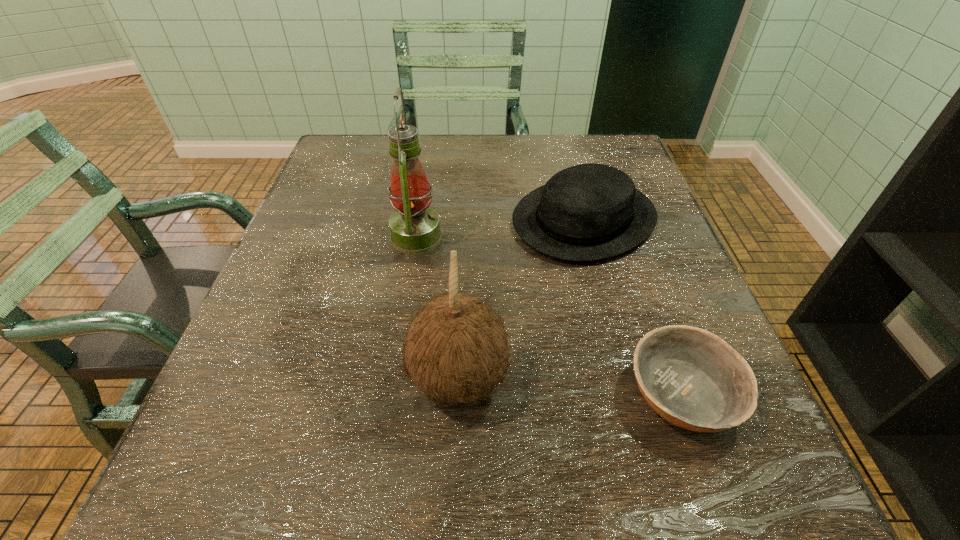
The image size is (960, 540). In order to click on blank space that satisfies the following two spatial constraints: 1. on the surface of the shortest object; 2. on the left side of the coconut in this screenshot , I will do pos(459,393).